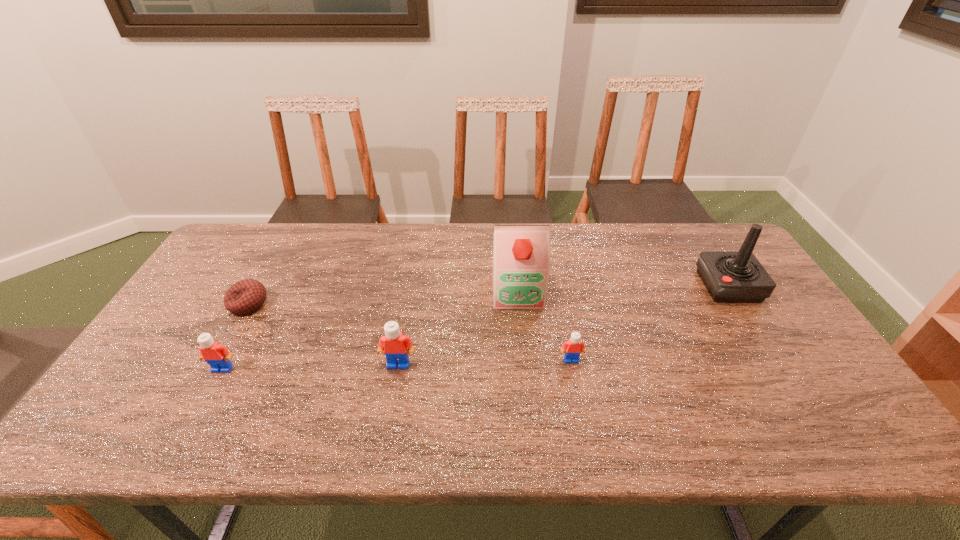
What are the coordinates of `free spot between the shortest object and the second tallest Lego` in the screenshot? It's located at (235, 336).

Locate an element on the screen. The image size is (960, 540). free space between the third object from left to right and the fifth tallest object is located at coordinates (485, 362).

This screenshot has width=960, height=540. What are the coordinates of `free space between the shortest Lego and the third object from left to right` in the screenshot? It's located at (485, 362).

Where is `empty location between the tallest Lego and the third shortest object`? This screenshot has width=960, height=540. empty location between the tallest Lego and the third shortest object is located at coordinates (310, 366).

Identify which object is the second closest to the joystick. Please provide its 2D coordinates. Your answer should be formatted as a tuple, i.e. [(x, y)], where the tuple contains the x and y coordinates of a point satisfying the conditions above.

[(521, 262)]

Where is `object that stands as the fourth closest to the joystick`? Image resolution: width=960 pixels, height=540 pixels. object that stands as the fourth closest to the joystick is located at coordinates (245, 296).

In order to click on the second closest Lego to the fourth shortest object in this screenshot , I will do click(573, 346).

What are the coordinates of `Lego identified as the closest to the fourth tallest object` in the screenshot? It's located at (394, 344).

You are a GUI agent. You are given a task and a screenshot of the screen. Output one action in this format:
    pyautogui.click(x=<x>, y=<y>)
    Task: Click on the free space that satisfies the following two spatial constraints: 1. on the front-facing side of the joystick; 2. with the cap open on the soya milk
    The width and height of the screenshot is (960, 540).
    Given the screenshot: What is the action you would take?
    pyautogui.click(x=732, y=291)

At what (x,y) coordinates should I click in order to perform the action: click on free space that satisfies the following two spatial constraints: 1. on the front-facing side of the rightmost object; 2. with the cap open on the third object from right to left. Please return your answer as a coordinate pair (x, y). The width and height of the screenshot is (960, 540). Looking at the image, I should click on (732, 291).